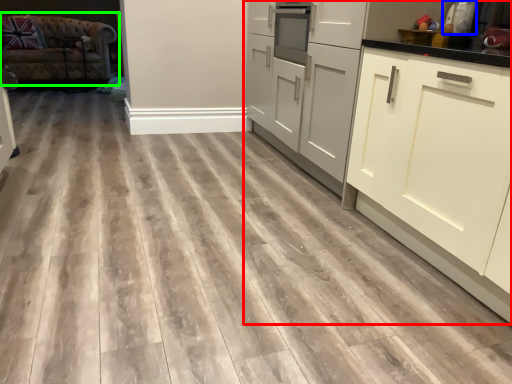
Question: Considering the real-world distances, which object is closest to cabinetry (highlighted by a red box)? appliance (highlighted by a blue box) or studio couch (highlighted by a green box).

Choices:
 (A) appliance
 (B) studio couch

Answer: (A)